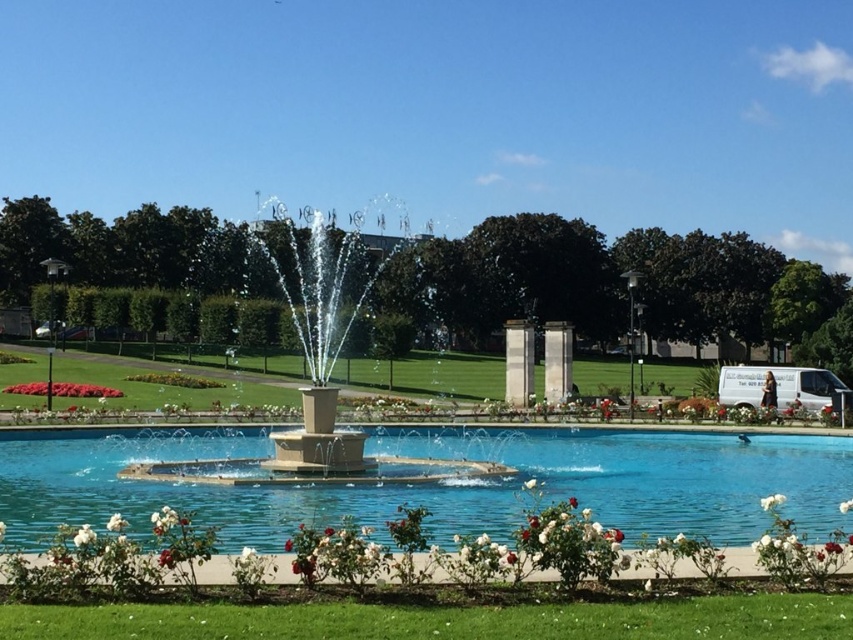
You are standing in the park and want to take a photo of both the fountain and the flower beds. You notice two specific points in the scene labeled as point 1 at coordinates point (80, 545) and point 2 at coordinates point (844, 509). Which point should you focus on first to ensure both the fountain and the flowers are in clear view?

Point 1 at coordinates point (80, 545) is closer to the viewer than point 2 at coordinates point (844, 509). Therefore, focusing on point 1 first will ensure both the fountain and the flowers are in clear view since it is nearer to your position.

You are a photographer standing in the park and want to capture the white fluffy flower at lower left and the clear glass water at center in the same frame. Based on their positions, will the flower appear in front of or behind the water in the photo?

The clear glass water at center is positioned under the white fluffy flower at lower left, so the flower will appear in front of the water in the photo.